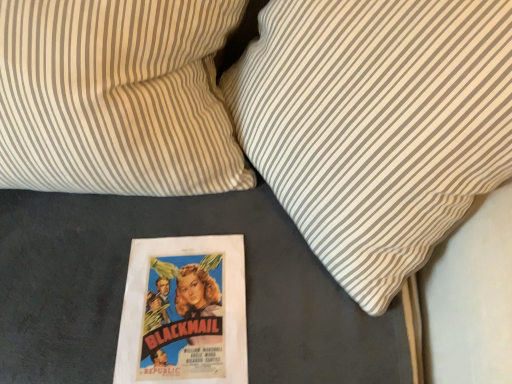
Question: In which direction should I rotate to look at white striped pillow at center, the 2th pillow from the left?

Choices:
 (A) right
 (B) left

Answer: (A)

Question: Is the depth of white striped pillow at center, the 2th pillow from the left, less than that of white striped pillow at upper right, marked as the 1th pillow in a left-to-right arrangement?

Choices:
 (A) no
 (B) yes

Answer: (B)

Question: Does white striped pillow at center, the 2th pillow from the left, come behind white striped pillow at upper right, which is the second pillow from right to left?

Choices:
 (A) yes
 (B) no

Answer: (B)

Question: Considering the relative sizes of white striped pillow at center, the 2th pillow from the left, and white striped pillow at upper right, which is the second pillow from right to left, in the image provided, is white striped pillow at center, the 2th pillow from the left, smaller than white striped pillow at upper right, which is the second pillow from right to left,?

Choices:
 (A) no
 (B) yes

Answer: (A)

Question: Is white striped pillow at center, the 2th pillow from the left, oriented towards white striped pillow at upper right, marked as the 1th pillow in a left-to-right arrangement?

Choices:
 (A) yes
 (B) no

Answer: (A)

Question: Is white striped pillow at center, the 2th pillow from the left, facing away from white striped pillow at upper right, which is the second pillow from right to left?

Choices:
 (A) no
 (B) yes

Answer: (A)

Question: Is white striped pillow at center, the 2th pillow from the left, taller than white striped pillow at upper right, which is the second pillow from right to left?

Choices:
 (A) yes
 (B) no

Answer: (A)

Question: Could you tell me if white striped pillow at upper right, which is the second pillow from right to left, is turned towards white striped pillow at center, the 2th pillow from the left?

Choices:
 (A) yes
 (B) no

Answer: (B)

Question: Considering the relative sizes of white striped pillow at upper right, marked as the 1th pillow in a left-to-right arrangement, and white striped pillow at center, which ranks as the first pillow in right-to-left order, in the image provided, is white striped pillow at upper right, marked as the 1th pillow in a left-to-right arrangement, taller than white striped pillow at center, which ranks as the first pillow in right-to-left order,?

Choices:
 (A) no
 (B) yes

Answer: (A)

Question: Can you confirm if white striped pillow at upper right, marked as the 1th pillow in a left-to-right arrangement, is positioned to the right of white striped pillow at center, the 2th pillow from the left?

Choices:
 (A) yes
 (B) no

Answer: (B)

Question: Considering the relative sizes of white striped pillow at upper right, which is the second pillow from right to left, and white striped pillow at center, which ranks as the first pillow in right-to-left order, in the image provided, is white striped pillow at upper right, which is the second pillow from right to left, thinner than white striped pillow at center, which ranks as the first pillow in right-to-left order,?

Choices:
 (A) no
 (B) yes

Answer: (B)

Question: From the image's perspective, is white striped pillow at upper right, which is the second pillow from right to left, below white striped pillow at center, which ranks as the first pillow in right-to-left order?

Choices:
 (A) yes
 (B) no

Answer: (B)

Question: Is white striped pillow at upper right, marked as the 1th pillow in a left-to-right arrangement, beside white striped pillow at center, which ranks as the first pillow in right-to-left order?

Choices:
 (A) no
 (B) yes

Answer: (A)

Question: Choose the correct answer: Is white striped pillow at upper right, which is the second pillow from right to left, inside white striped pillow at center, the 2th pillow from the left, or outside it?

Choices:
 (A) inside
 (B) outside

Answer: (B)